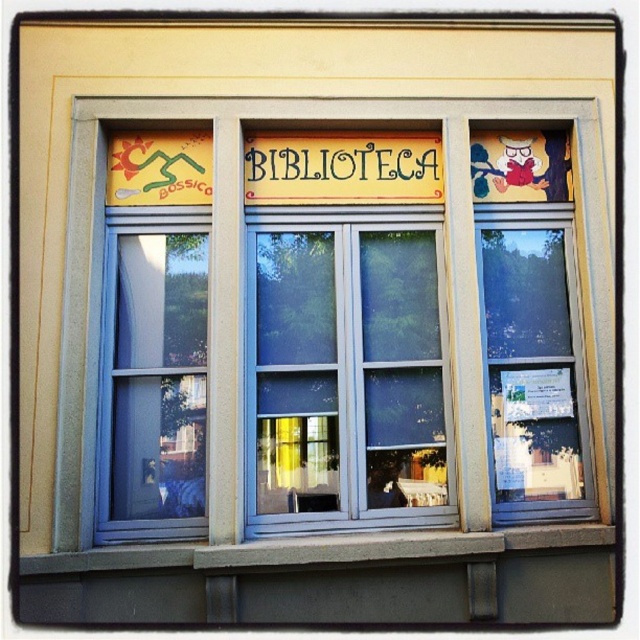
Does clear glass window at center appear on the right side of yellow painted wood sign at center?

Correct, you'll find clear glass window at center to the right of yellow painted wood sign at center.

Between clear glass window at center and yellow painted wood sign at center, which one appears on the left side from the viewer's perspective?

yellow painted wood sign at center is more to the left.

You are a GUI agent. You are given a task and a screenshot of the screen. Output one action in this format:
    pyautogui.click(x=<x>, y=<y>)
    Task: Click on the clear glass window at center
    The image size is (640, 640).
    Given the screenshot: What is the action you would take?
    pyautogui.click(x=346, y=372)

Is blue glass window at left wider than yellow painted wood sign at center?

No, blue glass window at left is not wider than yellow painted wood sign at center.

Is point (160, 464) farther from viewer compared to point (320, 184)?

No, it is in front of (320, 184).

The image size is (640, 640). Identify the location of blue glass window at left. (152, 378).

Find the location of a particular element. The height and width of the screenshot is (640, 640). clear glass window at center is located at coordinates (346, 372).

Is point (369, 333) positioned in front of point (186, 529)?

No, (369, 333) is further to viewer.

Locate an element on the screen. The height and width of the screenshot is (640, 640). clear glass window at center is located at coordinates (346, 372).